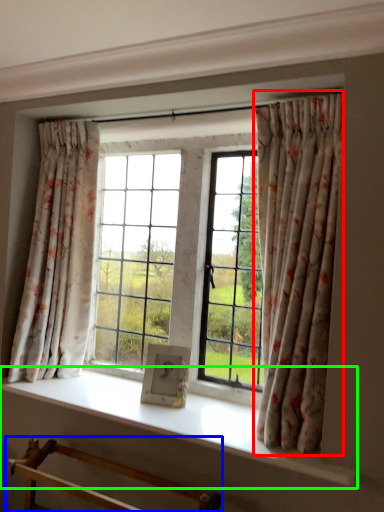
Question: Which object is the farthest from curtain (highlighted by a red box)? Choose among these: furniture (highlighted by a blue box) or window sill (highlighted by a green box).

Choices:
 (A) furniture
 (B) window sill

Answer: (A)